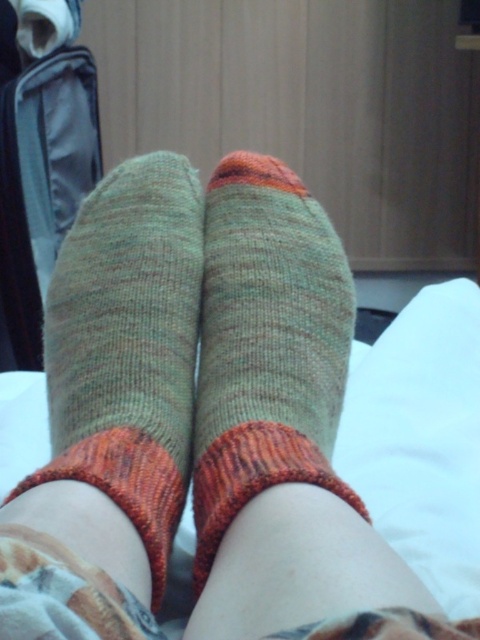
Between knitted wool socks at center and green knitted sock at center, which one has more height?

knitted wool socks at center

Can you confirm if knitted wool socks at center is positioned to the right of green knitted sock at center?

In fact, knitted wool socks at center is to the left of green knitted sock at center.

The image size is (480, 640). I want to click on knitted wool socks at center, so click(x=128, y=346).